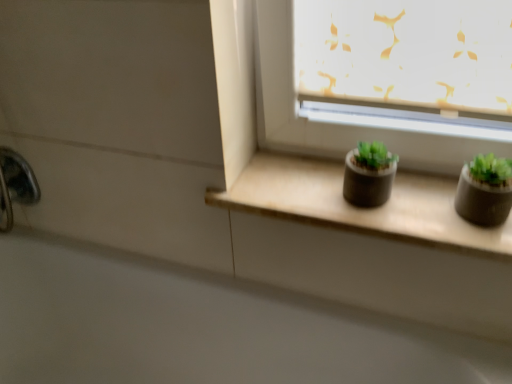
Locate an element on the screen. The width and height of the screenshot is (512, 384). vacant position to the left of matte gray flowerpot at right, positioned as the second flowerpot in left-to-right order is located at coordinates (412, 210).